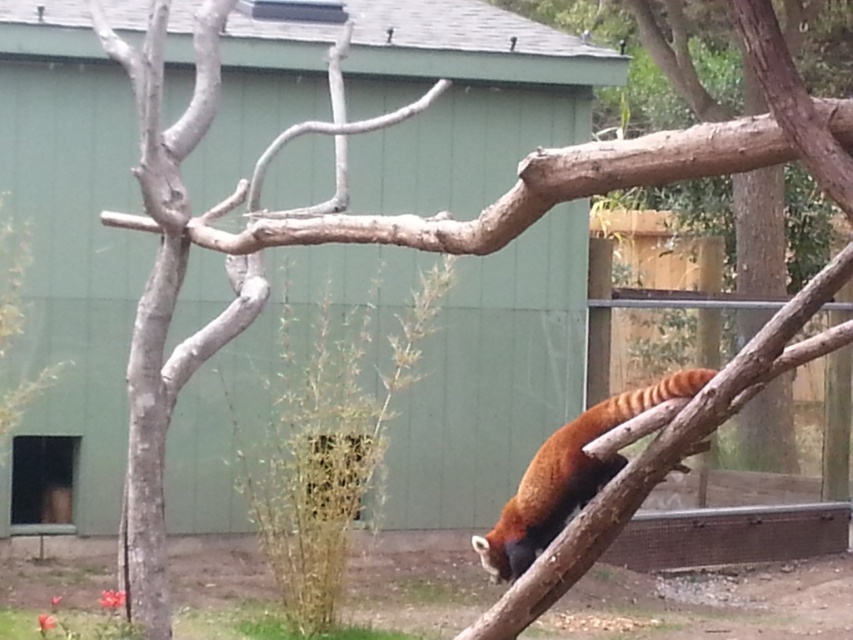
You are a zookeeper trying to locate two specific points in the red panda enclosure. The first point is at coordinates point (158, 618) and the second is at point (518, 520). Based on the image, which point is closer to the green building with the sloped roof?

Point (518, 520) is closer to the green building with the sloped roof because it is in front of point (158, 618), which is behind it.